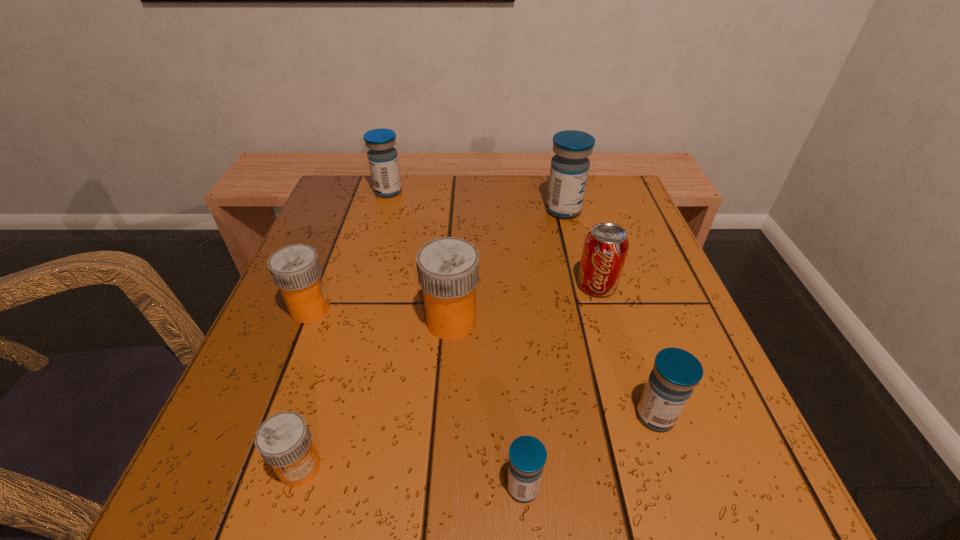
At what (x,y) coordinates should I click in order to perform the action: click on the third nearest object. Please return your answer as a coordinate pair (x, y). Looking at the image, I should click on (676, 372).

Locate an element on the screen. The image size is (960, 540). the smallest orange medicine is located at coordinates (283, 440).

This screenshot has width=960, height=540. Identify the location of the nearest orange medicine. (283, 440).

At what (x,y) coordinates should I click in order to perform the action: click on the fifth object from left to right. Please return your answer as a coordinate pair (x, y). The height and width of the screenshot is (540, 960). Looking at the image, I should click on (527, 455).

Where is `the third blue medicine from right to left`? the third blue medicine from right to left is located at coordinates (527, 455).

This screenshot has width=960, height=540. What are the coordinates of `vacant region located 0.120m on the back of the third nearest blue medicine` in the screenshot? It's located at (555, 176).

Find the location of `free space located on the front of the farthest medicine`. free space located on the front of the farthest medicine is located at coordinates (372, 247).

At what (x,y) coordinates should I click in order to perform the action: click on vacant position located 0.170m on the label side of the rightmost orange medicine. Please return your answer as a coordinate pair (x, y). Image resolution: width=960 pixels, height=540 pixels. Looking at the image, I should click on (574, 321).

You are a GUI agent. You are given a task and a screenshot of the screen. Output one action in this format:
    pyautogui.click(x=<x>, y=<y>)
    Task: Click on the vacant space located on the back of the soda can
    This screenshot has height=540, width=960.
    Given the screenshot: What is the action you would take?
    pyautogui.click(x=586, y=247)

The height and width of the screenshot is (540, 960). I want to click on free spot located on the label side of the leftmost orange medicine, so click(x=506, y=309).